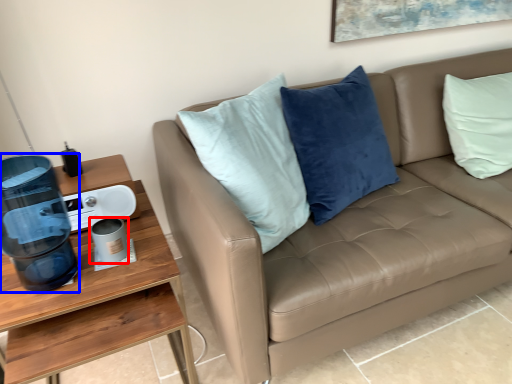
Question: Which object is further to the camera taking this photo, coffee cup (highlighted by a red box) or water cooler (highlighted by a blue box)?

Choices:
 (A) coffee cup
 (B) water cooler

Answer: (A)